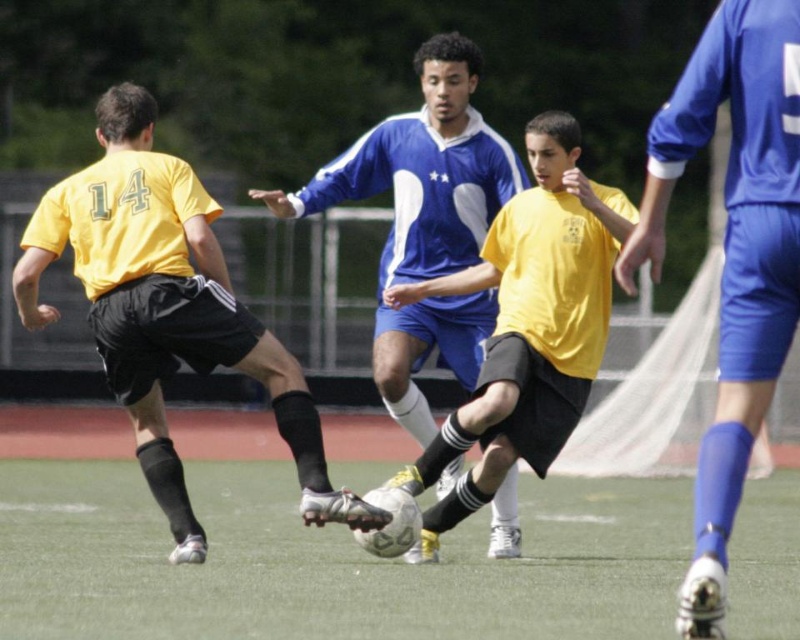
Question: Which of these objects is positioned closest to the green artificial turf at center?

Choices:
 (A) yellow matte shirt at center
 (B) blue matte soccer jersey at center

Answer: (A)

Question: Can you confirm if green artificial turf at center is positioned above matte yellow jersey at left?

Choices:
 (A) yes
 (B) no

Answer: (B)

Question: Which of these objects is positioned farthest from the yellow matte shirt at center?

Choices:
 (A) blue smooth soccer uniform at right
 (B) matte yellow jersey at left
 (C) blue matte soccer jersey at center
 (D) green artificial turf at center

Answer: (A)

Question: Which point is farther from the camera taking this photo?

Choices:
 (A) (106, 221)
 (B) (218, 499)
 (C) (562, 160)

Answer: (B)

Question: From the image, what is the correct spatial relationship of green artificial turf at center in relation to matte yellow jersey at left?

Choices:
 (A) above
 (B) below

Answer: (B)

Question: Does green artificial turf at center have a lesser width compared to blue matte soccer jersey at center?

Choices:
 (A) no
 (B) yes

Answer: (A)